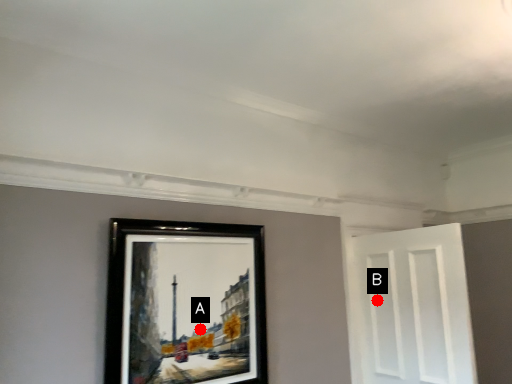
Question: Two points are circled on the image, labeled by A and B beside each circle. Which point is closer to the camera?

Choices:
 (A) A is closer
 (B) B is closer

Answer: (A)